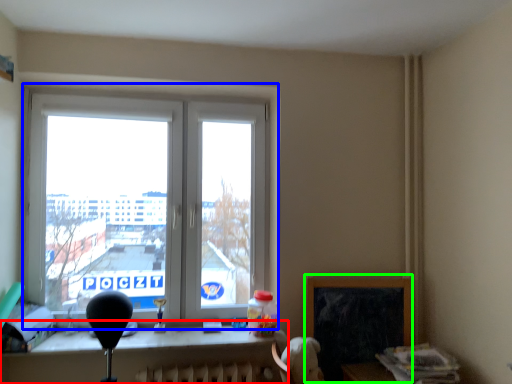
Question: Which object is the closest to the table (highlighted by a red box)? Choose among these: window (highlighted by a blue box) or window screen (highlighted by a green box).

Choices:
 (A) window
 (B) window screen

Answer: (B)